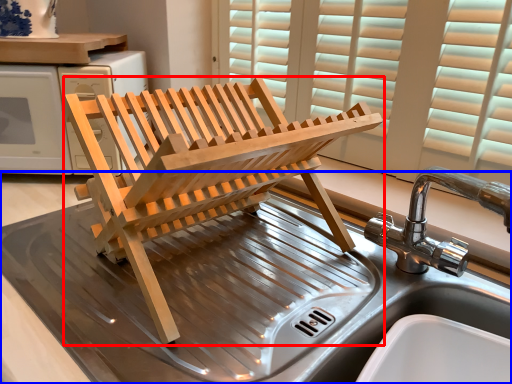
Question: Among these objects, which one is farthest to the camera, furniture (highlighted by a red box) or table (highlighted by a blue box)?

Choices:
 (A) furniture
 (B) table

Answer: (A)